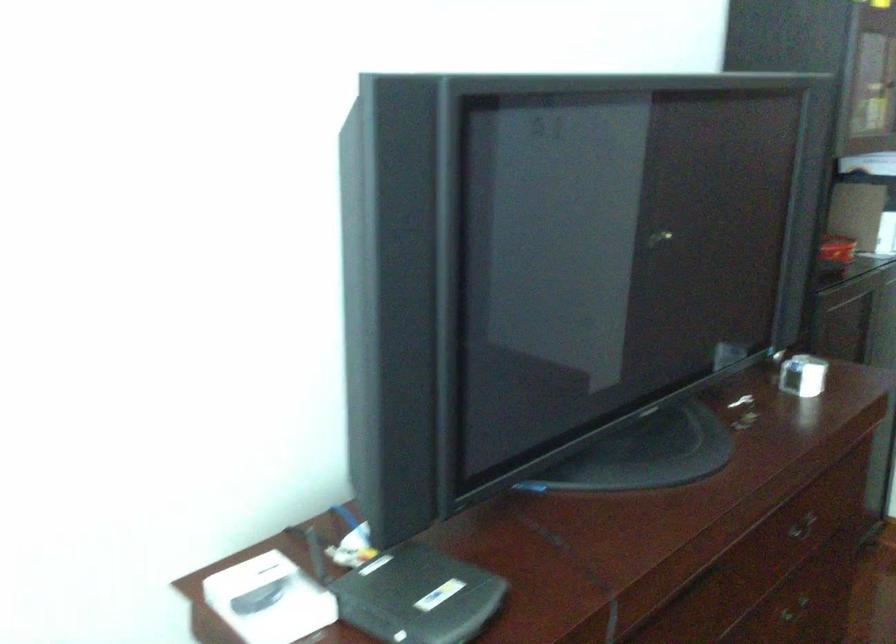
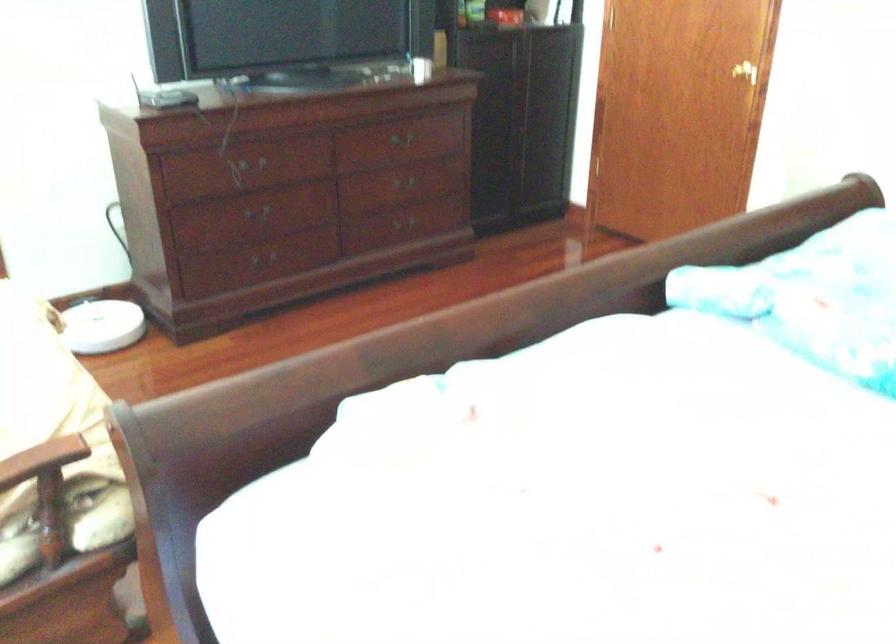
The point at (787, 534) is marked in the first image. Where is the corresponding point in the second image?

(401, 138)